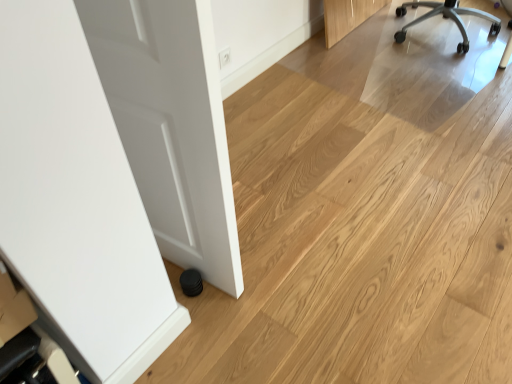
At what (x,y) coordinates should I click in order to perform the action: click on vacant space that is to the left of silver metallic chair at upper right. Please return your answer as a coordinate pair (x, y). Looking at the image, I should click on (358, 51).